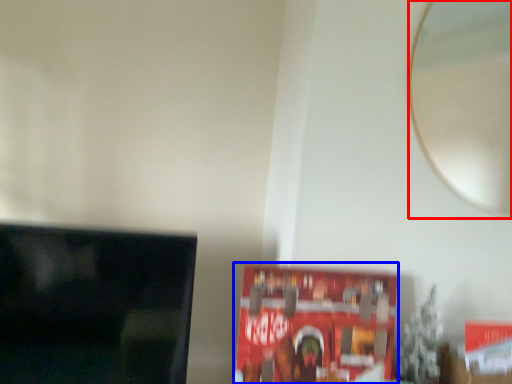
Question: Among these objects, which one is nearest to the camera, mirror (highlighted by a red box) or paperback book (highlighted by a blue box)?

Choices:
 (A) mirror
 (B) paperback book

Answer: (B)